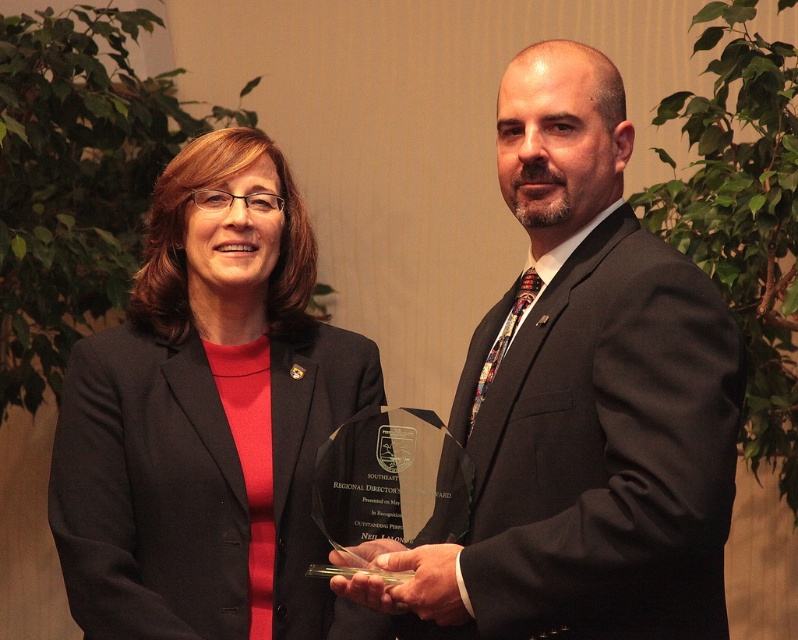
Question: Is matte black suit at center to the left of matte black blazer at center from the viewer's perspective?

Choices:
 (A) yes
 (B) no

Answer: (B)

Question: Does matte black suit at center appear on the left side of matte black blazer at center?

Choices:
 (A) yes
 (B) no

Answer: (B)

Question: Which point is farther from the camera taking this photo?

Choices:
 (A) (689, 490)
 (B) (267, 560)

Answer: (B)

Question: Does matte black suit at center appear on the right side of matte black blazer at center?

Choices:
 (A) yes
 (B) no

Answer: (A)